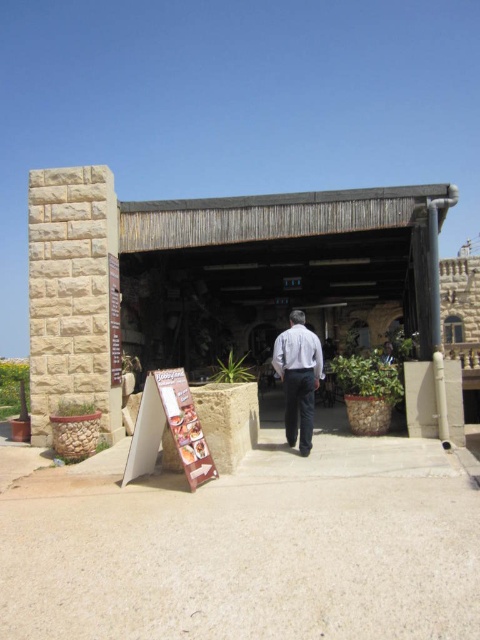
Is brown cardboard sign at center above white matte shirt at center?

Incorrect, brown cardboard sign at center is not positioned above white matte shirt at center.

Which is more to the right, brown cardboard sign at center or white matte shirt at center?

white matte shirt at center is more to the right.

At what (x,y) coordinates should I click in order to perform the action: click on brown cardboard sign at center. Please return your answer as a coordinate pair (x, y). Looking at the image, I should click on (184, 426).

Where is `brown cardboard sign at center`? The image size is (480, 640). brown cardboard sign at center is located at coordinates tap(184, 426).

Who is positioned more to the left, white cotton shirt at center or white matte shirt at center?

From the viewer's perspective, white cotton shirt at center appears more on the left side.

Measure the distance from white cotton shirt at center to white matte shirt at center.

white cotton shirt at center and white matte shirt at center are 3.05 inches apart.

Who is more distant from viewer, (300,355) or (296,364)?

The point (296,364) is more distant.

Image resolution: width=480 pixels, height=640 pixels. I want to click on white cotton shirt at center, so click(x=298, y=378).

Which is in front, point (300, 352) or point (182, 451)?

Point (182, 451)

Between white cotton shirt at center and brown cardboard sign at center, which one appears on the right side from the viewer's perspective?

white cotton shirt at center

Which is behind, point (302, 412) or point (183, 381)?

Positioned behind is point (302, 412).

Locate an element on the screen. This screenshot has height=640, width=480. white cotton shirt at center is located at coordinates (298, 378).